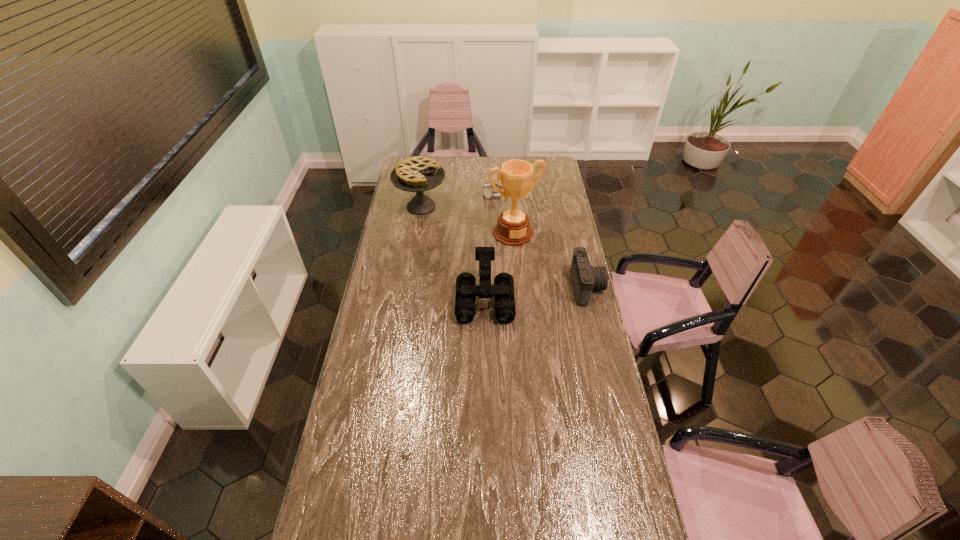
Locate an element on the screen. The image size is (960, 540). free space between the tallest object and the third shortest object is located at coordinates (499, 266).

In order to click on vacant space that is in between the pie and the tallest object in this screenshot , I will do `click(467, 220)`.

Find the location of `vacant region between the second tallest object and the shortest object`. vacant region between the second tallest object and the shortest object is located at coordinates (457, 201).

Choose which object is the fourth nearest neighbor to the watch. Please provide its 2D coordinates. Your answer should be formatted as a tuple, i.e. [(x, y)], where the tuple contains the x and y coordinates of a point satisfying the conditions above.

[(585, 278)]

Where is `object that stands as the closest to the third shortest object`? The height and width of the screenshot is (540, 960). object that stands as the closest to the third shortest object is located at coordinates (513, 229).

Locate an element on the screen. The image size is (960, 540). free space that satisfies the following two spatial constraints: 1. on the front side of the shortest object; 2. at the lens of the camera is located at coordinates (496, 287).

Identify the location of vacant space that satisfies the following two spatial constraints: 1. on the front side of the pie; 2. on the right side of the tallest object. The image size is (960, 540). (417, 233).

Find the location of `vacant space that satisfies the following two spatial constraints: 1. on the back side of the watch; 2. on the left side of the second tallest object`. vacant space that satisfies the following two spatial constraints: 1. on the back side of the watch; 2. on the left side of the second tallest object is located at coordinates (423, 195).

Where is `free space that satisfies the following two spatial constraints: 1. on the front side of the watch; 2. at the lens of the second shortest object`? The image size is (960, 540). free space that satisfies the following two spatial constraints: 1. on the front side of the watch; 2. at the lens of the second shortest object is located at coordinates (496, 287).